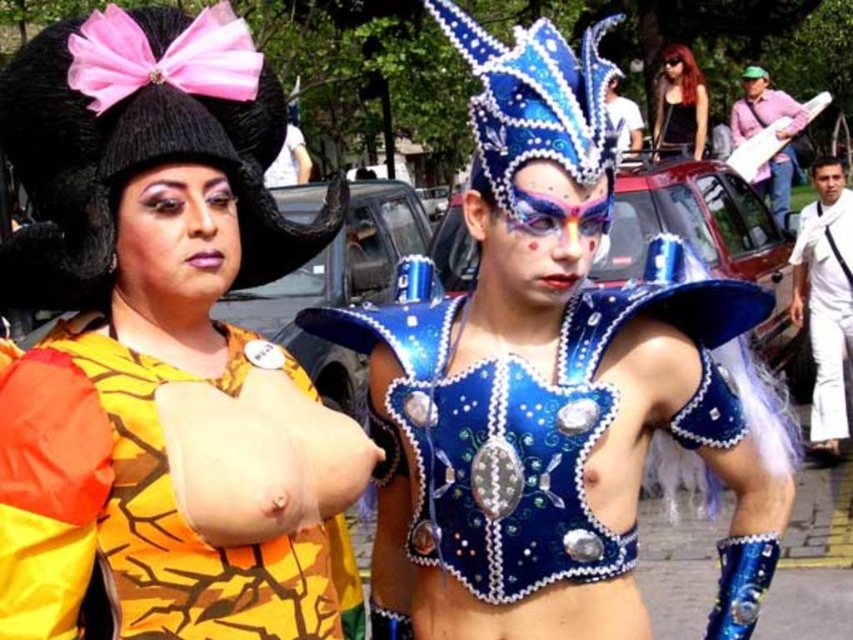
Consider the image. Who is more distant from viewer, (50, 436) or (839, 346)?

Positioned behind is point (839, 346).

Locate an element on the screen. yellow cracked fabric at center is located at coordinates coord(64,483).

Which is below, yellow cracked fabric top at upper left or shiny black hair at upper right?

yellow cracked fabric top at upper left is below.

Identify the location of yellow cracked fabric top at upper left. The width and height of the screenshot is (853, 640). (175, 326).

Does yellow cracked fabric top at upper left have a greater width compared to black knitted hat with pink bow at upper left?

Correct, the width of yellow cracked fabric top at upper left exceeds that of black knitted hat with pink bow at upper left.

How much distance is there between yellow cracked fabric top at upper left and black knitted hat with pink bow at upper left?

A distance of 40.99 centimeters exists between yellow cracked fabric top at upper left and black knitted hat with pink bow at upper left.

Does point (32, 163) lie in front of point (53, 129)?

No.

You are a GUI agent. You are given a task and a screenshot of the screen. Output one action in this format:
    pyautogui.click(x=<x>, y=<y>)
    Task: Click on the yellow cracked fabric top at upper left
    
    Given the screenshot: What is the action you would take?
    pyautogui.click(x=175, y=326)